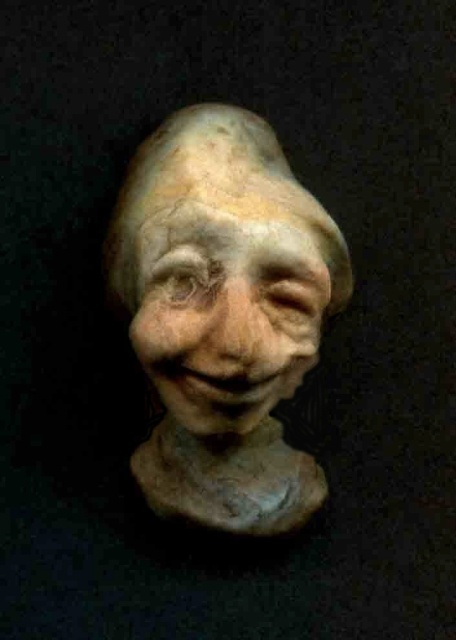
Question: Which point is closer to the camera?

Choices:
 (A) matte clay sculpture at center
 (B) matte clay face at center

Answer: (B)

Question: Observing the image, what is the correct spatial positioning of matte clay sculpture at center in reference to matte clay face at center?

Choices:
 (A) below
 (B) above

Answer: (A)

Question: Which point appears closest to the camera in this image?

Choices:
 (A) (184, 396)
 (B) (182, 284)

Answer: (B)

Question: Is matte clay sculpture at center to the right of matte clay face at center from the viewer's perspective?

Choices:
 (A) no
 (B) yes

Answer: (A)

Question: Is matte clay sculpture at center wider than matte clay face at center?

Choices:
 (A) no
 (B) yes

Answer: (B)